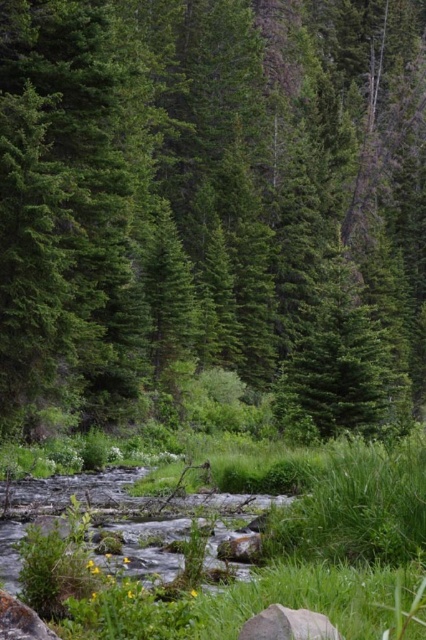
Question: Which of the following is the farthest from the observer?

Choices:
 (A) (271, 596)
 (B) (296, 616)
 (C) (100, 349)

Answer: (C)

Question: Which point appears closest to the camera in this image?

Choices:
 (A) (327, 624)
 (B) (11, 250)

Answer: (A)

Question: Does green matte tree at center lie behind green grass at center?

Choices:
 (A) yes
 (B) no

Answer: (A)

Question: Is green grass at center to the left of gray matte rock at lower center from the viewer's perspective?

Choices:
 (A) no
 (B) yes

Answer: (B)

Question: Which point is closer to the camera?

Choices:
 (A) (26, 184)
 (B) (311, 544)
 (C) (279, 628)

Answer: (C)

Question: Is the position of green grass at center more distant than that of gray matte rock at lower center?

Choices:
 (A) no
 (B) yes

Answer: (B)